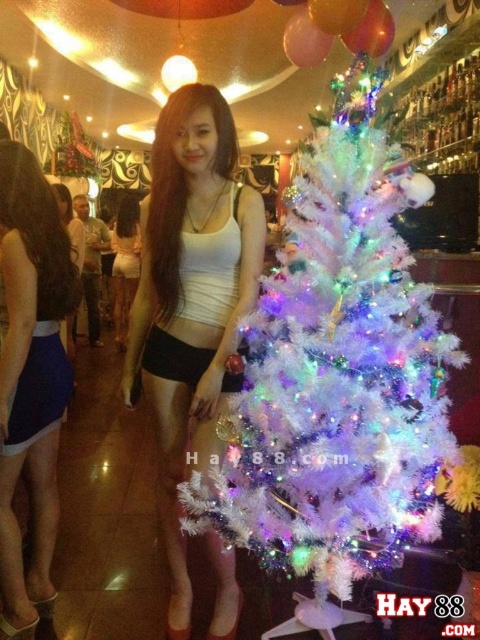
Between white fluffy christmas tree at center and white matte tank top at center, which one has less height?

Standing shorter between the two is white matte tank top at center.

Does point (418, 292) come closer to viewer compared to point (183, 113)?

Yes, it is in front of point (183, 113).

The width and height of the screenshot is (480, 640). Identify the location of white fluffy christmas tree at center. (336, 372).

Is white matte tank top at center smaller than blue satin skirt at lower left?

No.

From the picture: Is white matte tank top at center further to the viewer compared to blue satin skirt at lower left?

No, white matte tank top at center is in front of blue satin skirt at lower left.

Which is in front, point (230, 116) or point (11, 268)?

Point (230, 116) is more forward.

Locate an element on the screen. This screenshot has width=480, height=640. white matte tank top at center is located at coordinates (191, 298).

Does white fluffy christmas tree at center have a smaller size compared to blue satin skirt at lower left?

No, white fluffy christmas tree at center is not smaller than blue satin skirt at lower left.

Who is more distant from viewer, (412, 428) or (8, 269)?

The point (8, 269) is behind.

Where is `white fluffy christmas tree at center`? This screenshot has width=480, height=640. white fluffy christmas tree at center is located at coordinates (336, 372).